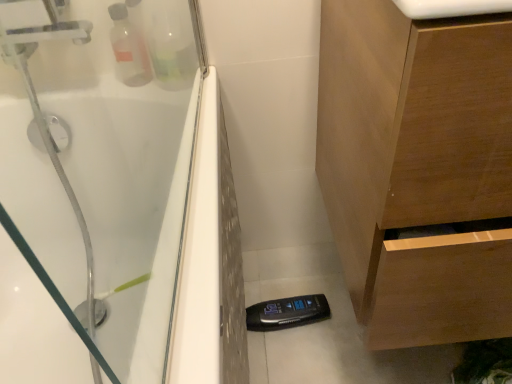
Where is `white glossy sink at upper center`? The width and height of the screenshot is (512, 384). white glossy sink at upper center is located at coordinates (450, 8).

In order to face white glossy sink at upper center, should I rotate leftwards or rightwards?

To align with it, rotate right about 24.720°.

This screenshot has height=384, width=512. Describe the element at coordinates (450, 8) in the screenshot. I see `white glossy sink at upper center` at that location.

The width and height of the screenshot is (512, 384). Describe the element at coordinates (418, 168) in the screenshot. I see `wooden cabinet at lower right` at that location.

The width and height of the screenshot is (512, 384). Find the location of `wooden cabinet at lower right`. wooden cabinet at lower right is located at coordinates (418, 168).

This screenshot has height=384, width=512. Identify the location of white glossy sink at upper center. (450, 8).

Visually, is white glossy sink at upper center positioned to the left or to the right of wooden cabinet at lower right?

white glossy sink at upper center is positioned on wooden cabinet at lower right's left side.

Considering the positions of objects white glossy sink at upper center and wooden cabinet at lower right in the image provided, who is behind, white glossy sink at upper center or wooden cabinet at lower right?

Positioned behind is white glossy sink at upper center.

Which is more distant, (502, 4) or (487, 97)?

The point (487, 97) is more distant.

From the image's perspective, is white glossy sink at upper center located beneath wooden cabinet at lower right?

No.

From a real-world perspective, is white glossy sink at upper center above or below wooden cabinet at lower right?

white glossy sink at upper center is situated higher than wooden cabinet at lower right in the real world.

Based on the photo, considering the sizes of objects white glossy sink at upper center and wooden cabinet at lower right in the image provided, who is thinner, white glossy sink at upper center or wooden cabinet at lower right?

white glossy sink at upper center.

Considering the sizes of objects white glossy sink at upper center and wooden cabinet at lower right in the image provided, who is taller, white glossy sink at upper center or wooden cabinet at lower right?

With more height is wooden cabinet at lower right.

Between white glossy sink at upper center and wooden cabinet at lower right, which one has smaller size?

white glossy sink at upper center is smaller.

Choose the correct answer: Is white glossy sink at upper center inside wooden cabinet at lower right or outside it?

white glossy sink at upper center cannot be found inside wooden cabinet at lower right.

Can you see white glossy sink at upper center touching wooden cabinet at lower right?

They are not placed beside each other.

Is white glossy sink at upper center turned away from wooden cabinet at lower right?

white glossy sink at upper center does not have its back to wooden cabinet at lower right.

Can you tell me how much white glossy sink at upper center and wooden cabinet at lower right differ in facing direction?

The facing directions of white glossy sink at upper center and wooden cabinet at lower right are 0.871 degrees apart.

The height and width of the screenshot is (384, 512). Find the location of `bathroom cabinet on the right of the white glossy sink at upper center`. bathroom cabinet on the right of the white glossy sink at upper center is located at coordinates (418, 168).

Does wooden cabinet at lower right appear on the right side of white glossy sink at upper center?

Yes.

Is the depth of wooden cabinet at lower right less than that of white glossy sink at upper center?

Yes, the depth of wooden cabinet at lower right is less than that of white glossy sink at upper center.

Which is behind, point (391, 258) or point (418, 0)?

The point (391, 258) is more distant.

From the image's perspective, which object appears higher, wooden cabinet at lower right or white glossy sink at upper center?

white glossy sink at upper center is shown above in the image.

From a real-world perspective, which is physically above, wooden cabinet at lower right or white glossy sink at upper center?

From a 3D spatial view, white glossy sink at upper center is above.

Can you confirm if wooden cabinet at lower right is wider than white glossy sink at upper center?

Yes.

Considering the relative sizes of wooden cabinet at lower right and white glossy sink at upper center in the image provided, is wooden cabinet at lower right taller than white glossy sink at upper center?

Correct, wooden cabinet at lower right is much taller as white glossy sink at upper center.

Is wooden cabinet at lower right smaller than white glossy sink at upper center?

Incorrect, wooden cabinet at lower right is not smaller in size than white glossy sink at upper center.

Based on the photo, is wooden cabinet at lower right completely or partially outside of white glossy sink at upper center?

Yes, wooden cabinet at lower right is not within white glossy sink at upper center.

Is wooden cabinet at lower right positioned far away from white glossy sink at upper center?

No, wooden cabinet at lower right is not far from white glossy sink at upper center.

Does wooden cabinet at lower right turn towards white glossy sink at upper center?

No, wooden cabinet at lower right does not turn towards white glossy sink at upper center.

How far apart are wooden cabinet at lower right and white glossy sink at upper center?

They are 11.69 inches apart.

The height and width of the screenshot is (384, 512). Identify the location of counter top on the left of wooden cabinet at lower right. (450, 8).

Image resolution: width=512 pixels, height=384 pixels. Identify the location of counter top lying above the wooden cabinet at lower right (from the image's perspective). (450, 8).

At what (x,y) coordinates should I click in order to perform the action: click on bathroom cabinet in front of the white glossy sink at upper center. Please return your answer as a coordinate pair (x, y). Looking at the image, I should click on (418, 168).